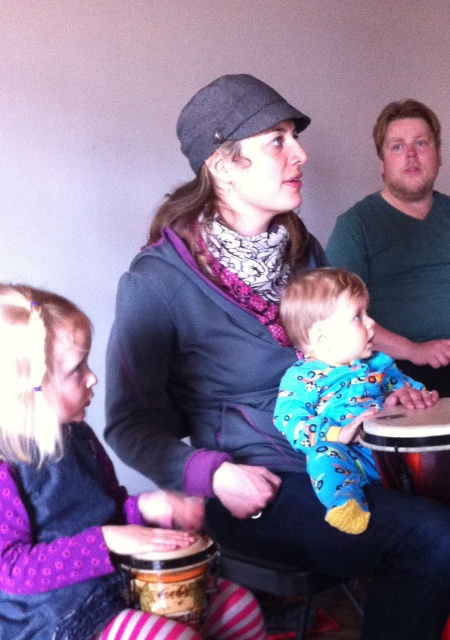
Can you confirm if brown textured drum at center is positioned to the right of wooden drum at lower left?

Indeed, brown textured drum at center is positioned on the right side of wooden drum at lower left.

Can you confirm if brown textured drum at center is shorter than wooden drum at lower left?

Incorrect, brown textured drum at center's height does not fall short of wooden drum at lower left's.

Does point (446, 413) come behind point (185, 605)?

Yes, it is.

The height and width of the screenshot is (640, 450). Identify the location of brown textured drum at center. coord(412,449).

Is floral pajamas at center taller than brown textured drum at center?

Indeed, floral pajamas at center has a greater height compared to brown textured drum at center.

From the picture: Can you confirm if floral pajamas at center is positioned to the right of brown textured drum at center?

In fact, floral pajamas at center is to the left of brown textured drum at center.

Is point (354, 458) closer to viewer compared to point (426, 452)?

That is False.

Locate an element on the screen. The height and width of the screenshot is (640, 450). floral pajamas at center is located at coordinates (337, 388).

Between point (25, 374) and point (179, 572), which one is positioned in front?

Positioned in front is point (25, 374).

Does point (81, 627) come farther from viewer compared to point (139, 556)?

That is False.

Between point (81, 577) and point (149, 566), which one is positioned behind?

The point (149, 566) is more distant.

Locate an element on the screen. The height and width of the screenshot is (640, 450). purple fleece dress at lower left is located at coordinates (67, 488).